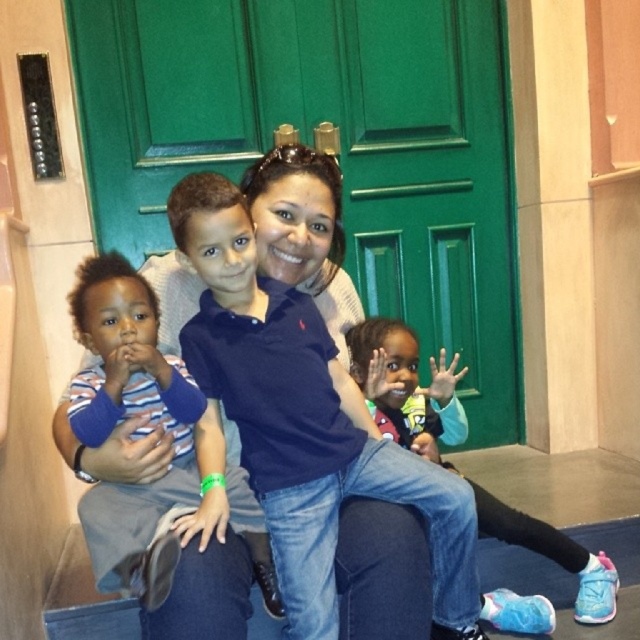
Question: Among these points, which one is farthest from the camera?

Choices:
 (A) (358, 602)
 (B) (116, 253)
 (C) (380, 390)

Answer: (B)

Question: Is striped cotton shirt at left bigger than blue fabric pants at lower right?

Choices:
 (A) yes
 (B) no

Answer: (B)

Question: Can you confirm if striped cotton shirt at left is positioned to the right of blue fabric pants at lower right?

Choices:
 (A) no
 (B) yes

Answer: (A)

Question: Considering the real-world distances, which object is farthest from the blue cotton shirt at center?

Choices:
 (A) striped cotton shirt at left
 (B) blue fabric pants at lower right

Answer: (B)

Question: Does striped cotton shirt at left have a smaller size compared to blue fabric pants at lower right?

Choices:
 (A) no
 (B) yes

Answer: (B)

Question: Which of these objects is positioned farthest from the striped cotton shirt at left?

Choices:
 (A) blue fabric pants at lower right
 (B) blue cotton shirt at center

Answer: (A)